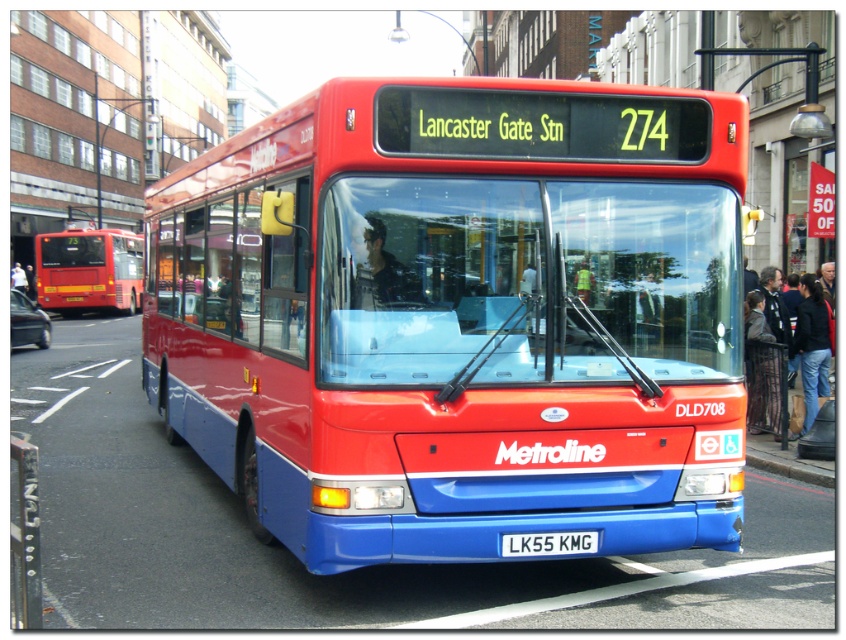
Who is higher up, metallic red bus at center or matte red bus at left?

matte red bus at left is above.

What do you see at coordinates (460, 317) in the screenshot? This screenshot has width=846, height=640. I see `metallic red bus at center` at bounding box center [460, 317].

Who is more forward, (x=445, y=204) or (x=62, y=289)?

Point (x=445, y=204) is in front.

Locate an element on the screen. metallic red bus at center is located at coordinates (460, 317).

Who is lower down, blue metallic license plate at center or concrete curb at lower right?

concrete curb at lower right is lower down.

This screenshot has height=640, width=846. What are the coordinates of `blue metallic license plate at center` in the screenshot? It's located at (548, 544).

Is matte red bus at left taller than blue metallic license plate at center?

Correct, matte red bus at left is much taller as blue metallic license plate at center.

Where is `matte red bus at left`? This screenshot has width=846, height=640. matte red bus at left is located at coordinates (88, 269).